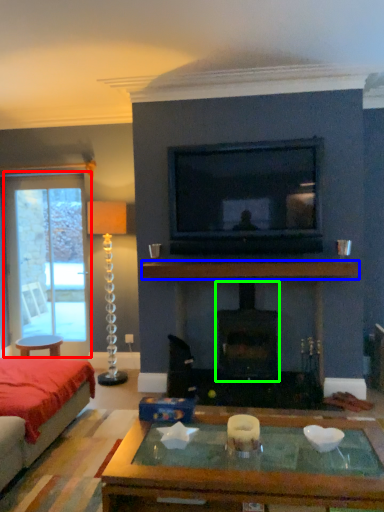
Question: Which object is the farthest from screen door (highlighted by a red box)? Choose among these: mantle (highlighted by a blue box) or fireplace (highlighted by a green box).

Choices:
 (A) mantle
 (B) fireplace

Answer: (B)